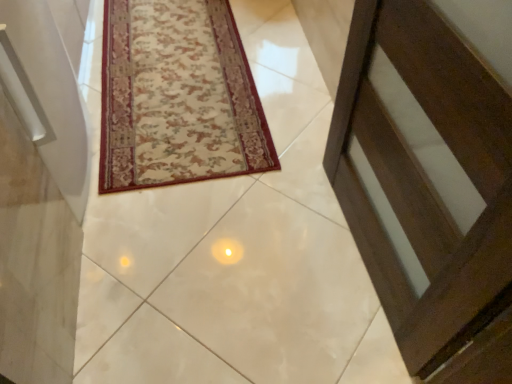
In order to face beige floral rug at center, should I rotate leftwards or rightwards?

To align with it, rotate left about 10.491°.

What do you see at coordinates (177, 97) in the screenshot? This screenshot has width=512, height=384. I see `beige floral rug at center` at bounding box center [177, 97].

Image resolution: width=512 pixels, height=384 pixels. In order to click on beige floral rug at center in this screenshot , I will do `click(177, 97)`.

Locate an element on the screen. This screenshot has width=512, height=384. white glossy tile at center is located at coordinates (234, 252).

The width and height of the screenshot is (512, 384). What do you see at coordinates (234, 252) in the screenshot? I see `white glossy tile at center` at bounding box center [234, 252].

The height and width of the screenshot is (384, 512). What are the coordinates of `beige floral rug at center` in the screenshot? It's located at (177, 97).

Which object is positioned more to the left, white glossy tile at center or beige floral rug at center?

Positioned to the left is beige floral rug at center.

Is the depth of white glossy tile at center greater than that of beige floral rug at center?

No, white glossy tile at center is closer to the camera.

Does point (214, 226) lie in front of point (210, 18)?

Yes, it is in front of point (210, 18).

From the image's perspective, which is below, white glossy tile at center or beige floral rug at center?

white glossy tile at center appears lower in the image.

From a real-world perspective, between white glossy tile at center and beige floral rug at center, who is vertically lower?

white glossy tile at center is physically lower.

Consider the image. Which of these two, white glossy tile at center or beige floral rug at center, is thinner?

beige floral rug at center is thinner.

Is white glossy tile at center taller or shorter than beige floral rug at center?

Clearly, white glossy tile at center is taller compared to beige floral rug at center.

Does white glossy tile at center have a smaller size compared to beige floral rug at center?

Incorrect, white glossy tile at center is not smaller in size than beige floral rug at center.

Is beige floral rug at center completely or partially inside white glossy tile at center?

Yes, white glossy tile at center contains beige floral rug at center.

Is white glossy tile at center far from beige floral rug at center?

No, white glossy tile at center is in close proximity to beige floral rug at center.

Is white glossy tile at center positioned with its back to beige floral rug at center?

No, white glossy tile at center is not facing away from beige floral rug at center.

How different are the orientations of white glossy tile at center and beige floral rug at center in degrees?

The angle between the facing direction of white glossy tile at center and the facing direction of beige floral rug at center is 1.89 degrees.

At what (x,y) coordinates should I click in order to perform the action: click on mat that is on the left side of white glossy tile at center. Please return your answer as a coordinate pair (x, y). This screenshot has width=512, height=384. Looking at the image, I should click on (177, 97).

Which object is positioned more to the left, beige floral rug at center or white glossy tile at center?

beige floral rug at center is more to the left.

Does beige floral rug at center come behind white glossy tile at center?

Yes, beige floral rug at center is behind white glossy tile at center.

Considering the points (225, 61) and (298, 154), which point is in front, point (225, 61) or point (298, 154)?

The point (298, 154) is closer to the camera.

From the image's perspective, is beige floral rug at center beneath white glossy tile at center?

No, from the image's perspective, beige floral rug at center is not beneath white glossy tile at center.

From a real-world perspective, who is located higher, beige floral rug at center or white glossy tile at center?

From a 3D spatial view, beige floral rug at center is above.

Which object is thinner, beige floral rug at center or white glossy tile at center?

Thinner between the two is beige floral rug at center.

Can you confirm if beige floral rug at center is taller than white glossy tile at center?

No, beige floral rug at center is not taller than white glossy tile at center.

Can you confirm if beige floral rug at center is smaller than white glossy tile at center?

Indeed, beige floral rug at center has a smaller size compared to white glossy tile at center.

Is beige floral rug at center surrounding white glossy tile at center?

Definitely not — white glossy tile at center is not inside beige floral rug at center.

Based on the photo, is beige floral rug at center not close to white glossy tile at center?

No, beige floral rug at center is in close proximity to white glossy tile at center.

Is beige floral rug at center oriented away from white glossy tile at center?

Yes, beige floral rug at center is facing away from white glossy tile at center.

Can you tell me how much beige floral rug at center and white glossy tile at center differ in facing direction?

1.89 degrees separate the facing orientations of beige floral rug at center and white glossy tile at center.

At what (x,y) coordinates should I click in order to perform the action: click on path located on the right of beige floral rug at center. Please return your answer as a coordinate pair (x, y). The image size is (512, 384). Looking at the image, I should click on (234, 252).

I want to click on path below the beige floral rug at center (from the image's perspective), so click(234, 252).

Identify the location of mat above the white glossy tile at center (from the image's perspective). [x=177, y=97].